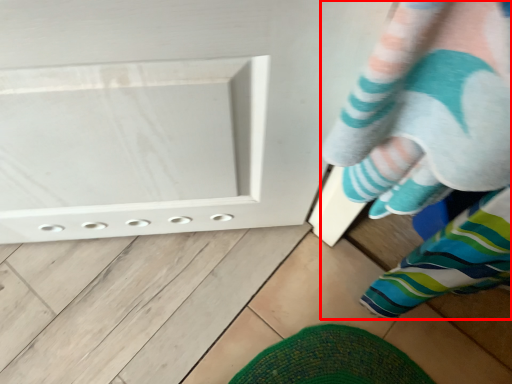
Question: From the image's perspective, what is the correct spatial positioning of person (annotated by the red box) in reference to footwear?

Choices:
 (A) above
 (B) below

Answer: (A)